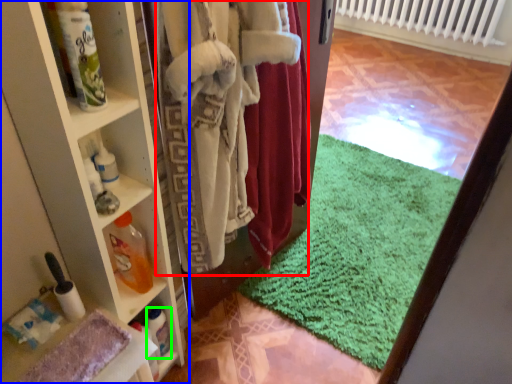
Question: Estimate the real-world distances between objects in this image. Which object is farther from clothing (highlighted by a red box), shelf (highlighted by a blue box) or bottle (highlighted by a green box)?

Choices:
 (A) shelf
 (B) bottle

Answer: (B)